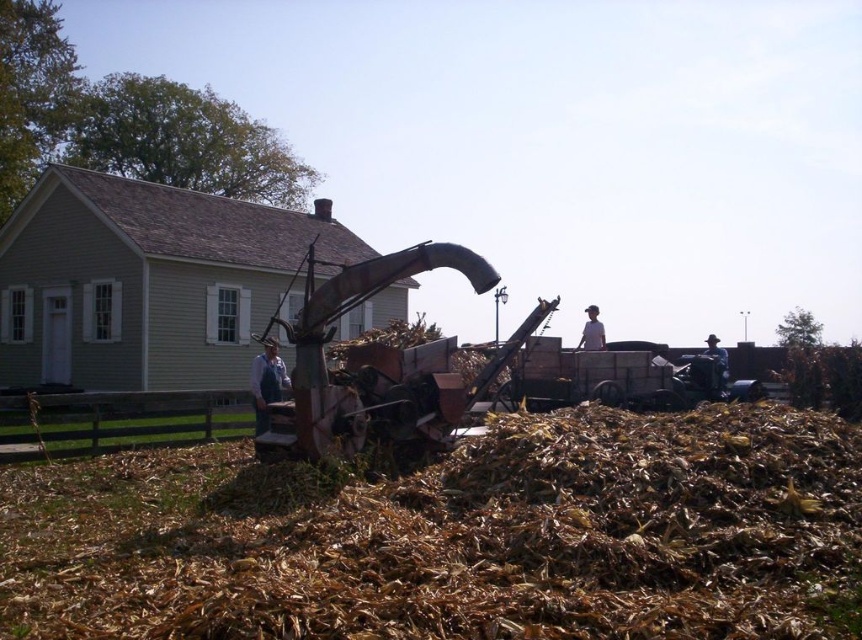
Question: Which is farther from the denim overalls at center?

Choices:
 (A) white cloth hat at upper right
 (B) brown leather hat at right
 (C) brown dry hay at center

Answer: (B)

Question: Which object is farther from the camera taking this photo?

Choices:
 (A) brown dry hay at center
 (B) white cloth hat at upper right

Answer: (B)

Question: Is white cloth hat at upper right thinner than brown leather hat at right?

Choices:
 (A) no
 (B) yes

Answer: (B)

Question: Observing the image, what is the correct spatial positioning of denim overalls at center in reference to white cloth hat at upper right?

Choices:
 (A) below
 (B) above

Answer: (A)

Question: Among these objects, which one is nearest to the camera?

Choices:
 (A) brown leather hat at right
 (B) white cloth hat at upper right

Answer: (B)

Question: Can you confirm if brown dry hay at center is positioned to the left of white cloth hat at upper right?

Choices:
 (A) no
 (B) yes

Answer: (B)